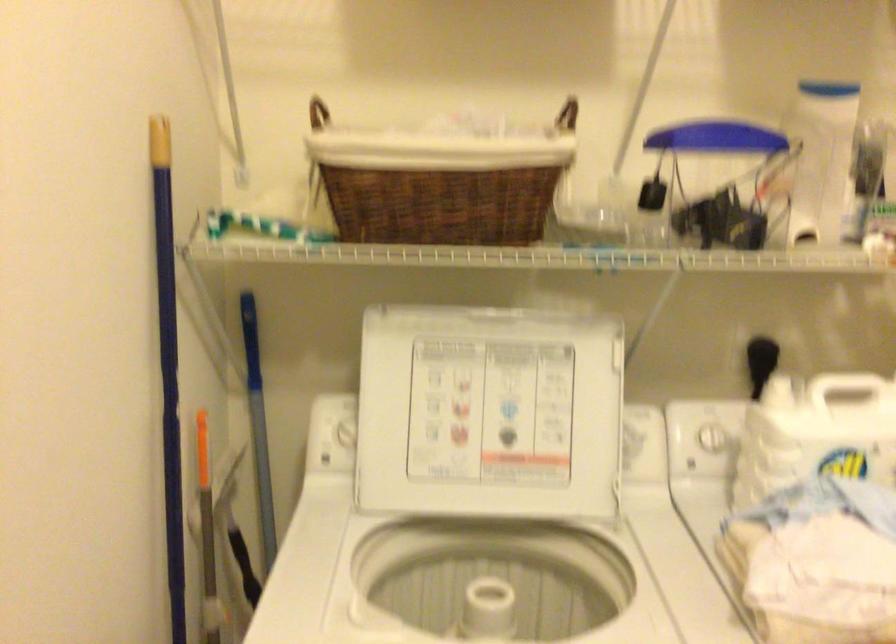
Find the location of `blue broom handle`. blue broom handle is located at coordinates pyautogui.click(x=168, y=366).